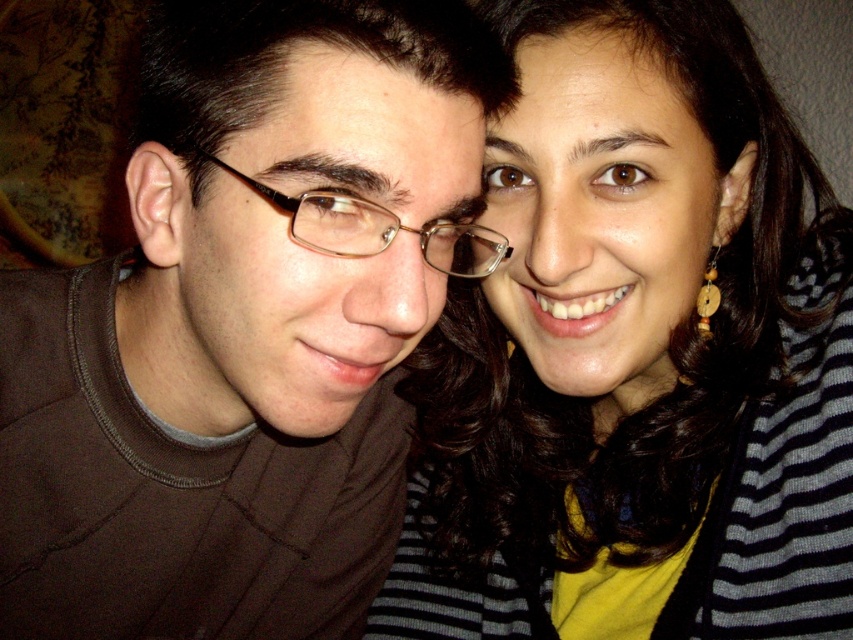
Question: Among these objects, which one is nearest to the camera?

Choices:
 (A) gold metallic glasses at center
 (B) striped sweater at upper right

Answer: (A)

Question: Which object appears farthest from the camera in this image?

Choices:
 (A) matte brown shirt at center
 (B) striped sweater at upper right
 (C) gold metallic glasses at center
 (D) wooden round earring at right

Answer: (D)

Question: Is matte brown shirt at center positioned behind gold metallic glasses at center?

Choices:
 (A) yes
 (B) no

Answer: (B)

Question: Can you confirm if matte brown shirt at center is positioned to the right of striped sweater at upper right?

Choices:
 (A) no
 (B) yes

Answer: (A)

Question: Among these points, which one is farthest from the camera?

Choices:
 (A) (698, 294)
 (B) (363, 336)
 (C) (311, 228)

Answer: (A)

Question: Does matte brown shirt at center have a larger size compared to striped sweater at upper right?

Choices:
 (A) yes
 (B) no

Answer: (B)